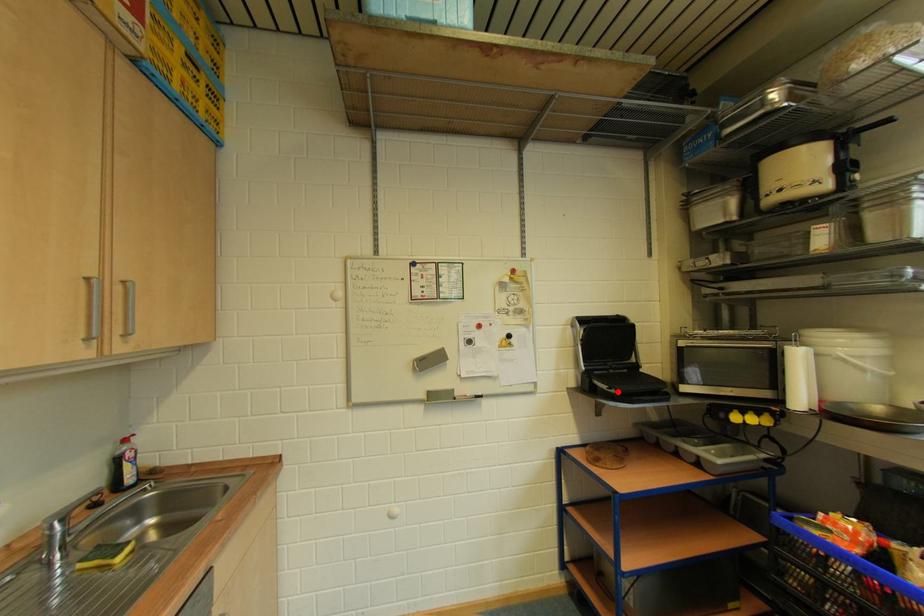
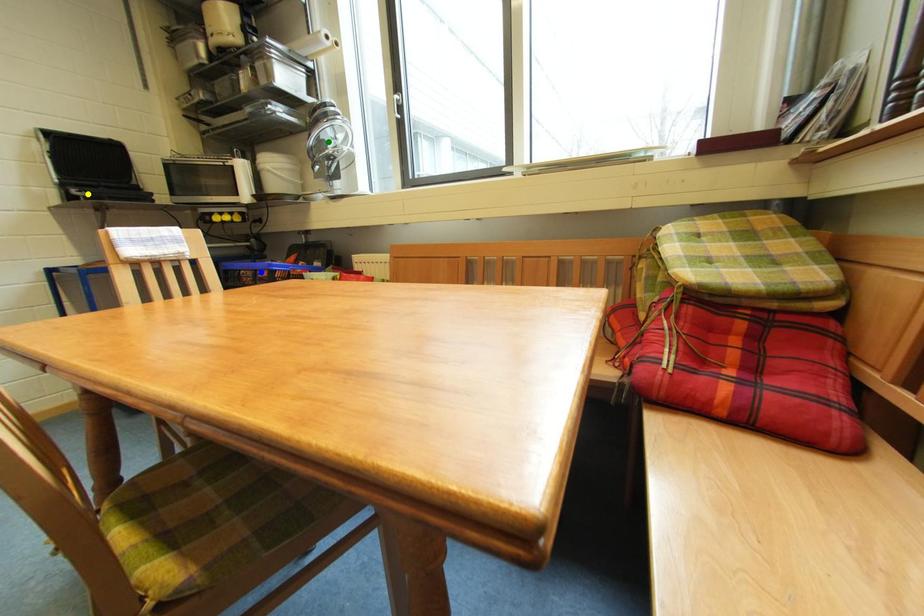
Question: I am providing you with two images of the same scene from different viewpoints. A red point is marked on the first image. You are given multiple points on the second image. In image 2, which mark is for the same physical point as the one in image 1?

Choices:
 (A) blue point
 (B) green point
 (C) yellow point

Answer: (C)